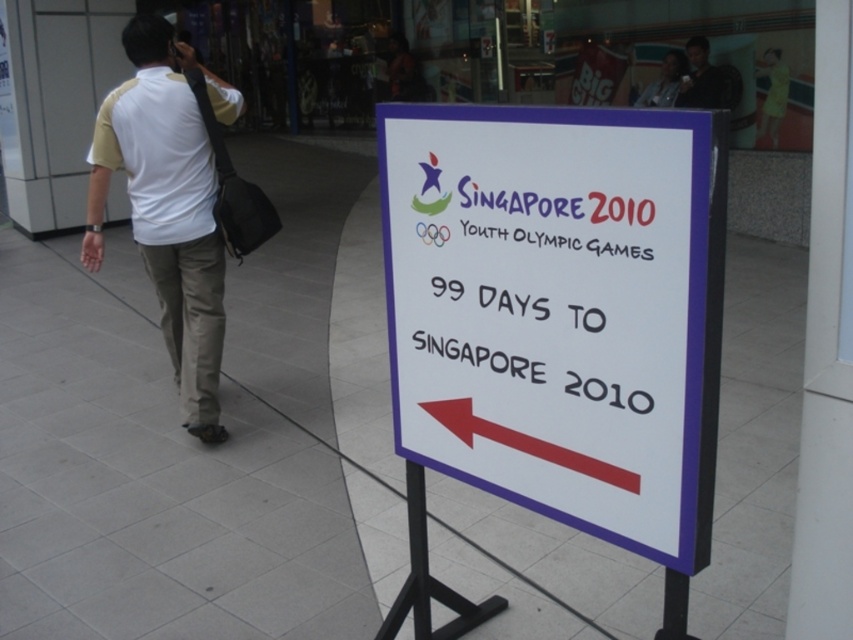
Can you confirm if white paper sign at center is smaller than white cotton shirt at left?

Correct, white paper sign at center occupies less space than white cotton shirt at left.

Between point (590, 442) and point (140, 99), which one is positioned behind?

Point (140, 99)

Where is `white paper sign at center`? This screenshot has height=640, width=853. white paper sign at center is located at coordinates (560, 310).

Between white cotton shirt at left and red plastic arrow at lower center, which one is positioned lower?

red plastic arrow at lower center is lower down.

Describe the element at coordinates (167, 204) in the screenshot. The image size is (853, 640). I see `white cotton shirt at left` at that location.

The image size is (853, 640). What are the coordinates of `white cotton shirt at left` in the screenshot? It's located at (167, 204).

Who is higher up, white tile pavement at center or red plastic arrow at lower center?

red plastic arrow at lower center

Does white tile pavement at center appear under red plastic arrow at lower center?

Correct, white tile pavement at center is located below red plastic arrow at lower center.

What do you see at coordinates (190, 438) in the screenshot? This screenshot has height=640, width=853. I see `white tile pavement at center` at bounding box center [190, 438].

The image size is (853, 640). Find the location of `white tile pavement at center`. white tile pavement at center is located at coordinates (190, 438).